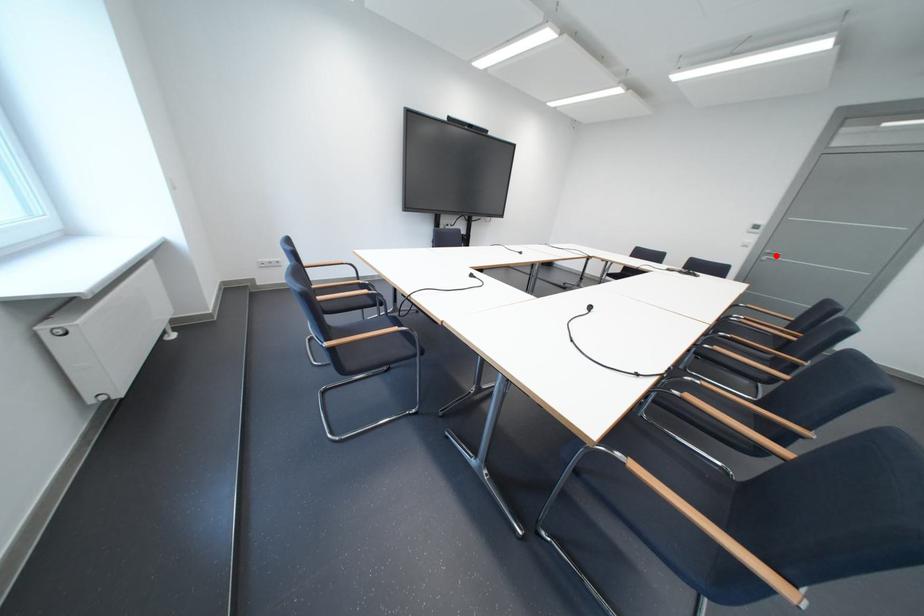
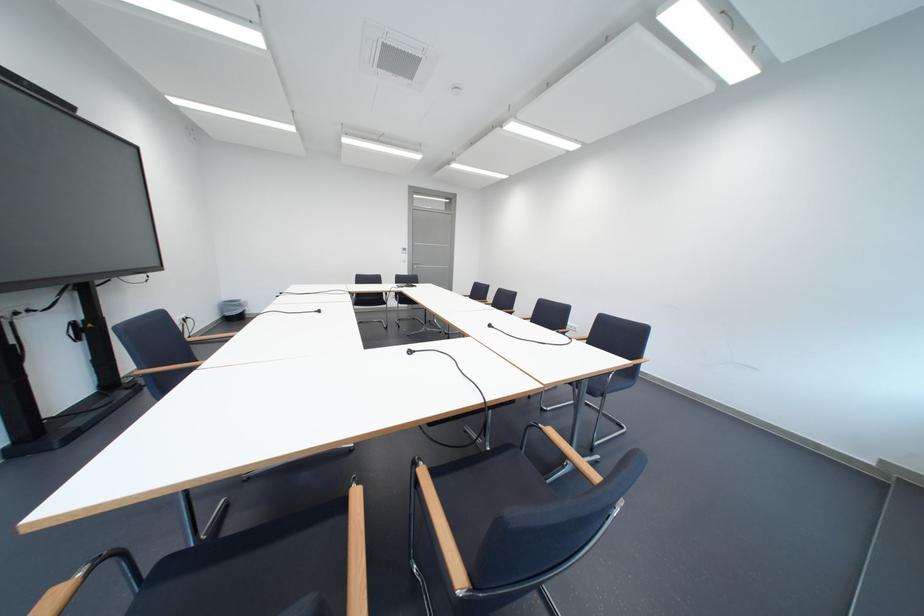
Question: I am providing you with two images of the same scene from different viewpoints. A red point is shown in image1. For the corresponding object point in image2, is it positioned nearer or farther from the camera?

Choices:
 (A) Nearer
 (B) Farther

Answer: (A)